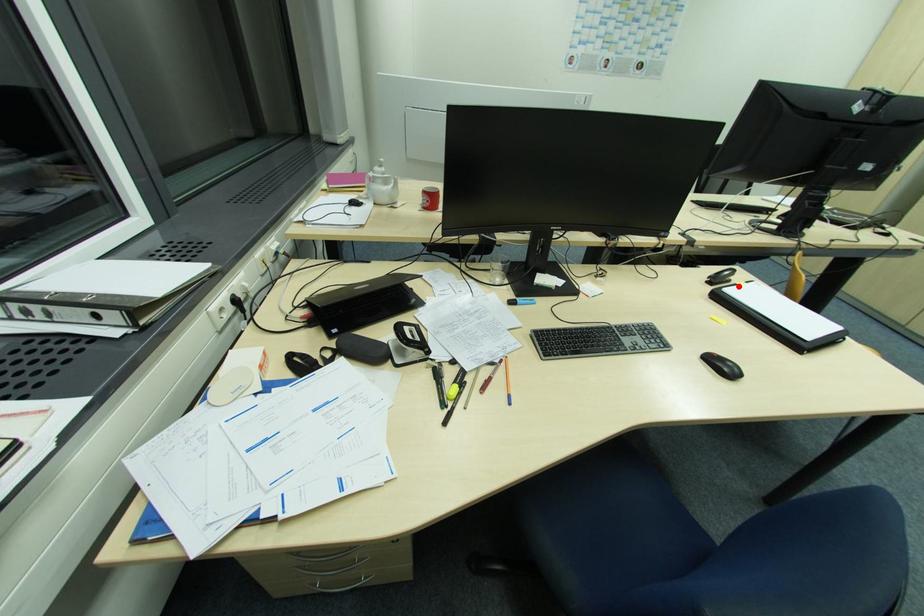
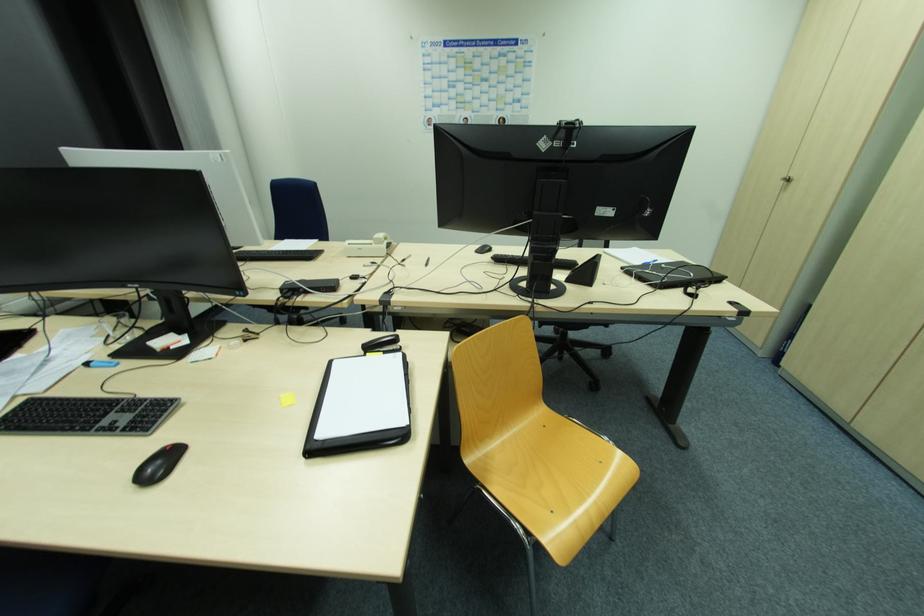
Locate, in the second image, the point that corresponds to the highlighted location in the first image.

(368, 357)